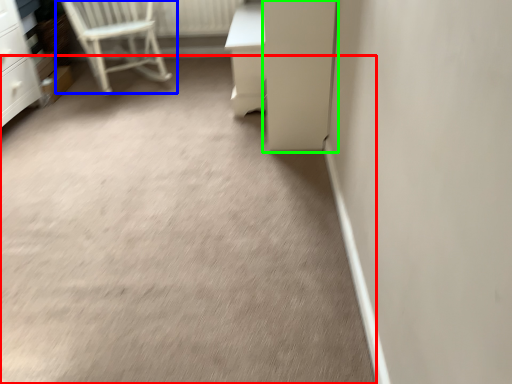
Question: Based on their relative distances, which object is farther from concrete (highlighted by a red box)? Choose from chair (highlighted by a blue box) and screen door (highlighted by a green box).

Choices:
 (A) chair
 (B) screen door

Answer: (A)